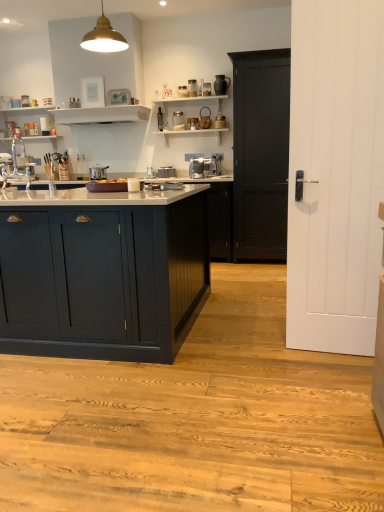
Question: Is white glossy sink at left not close to satin silver pot at center, which ranks as the 2th appliance in right-to-left order?

Choices:
 (A) yes
 (B) no

Answer: (B)

Question: Is satin silver pot at center, which appears as the first appliance when viewed from the left, surrounded by white glossy sink at left?

Choices:
 (A) no
 (B) yes

Answer: (A)

Question: Considering the relative sizes of white glossy sink at left and satin silver pot at center, which ranks as the 2th appliance in right-to-left order, in the image provided, is white glossy sink at left wider than satin silver pot at center, which ranks as the 2th appliance in right-to-left order,?

Choices:
 (A) yes
 (B) no

Answer: (B)

Question: Is white glossy sink at left oriented towards satin silver pot at center, which appears as the first appliance when viewed from the left?

Choices:
 (A) no
 (B) yes

Answer: (B)

Question: Can we say white glossy sink at left lies outside satin silver pot at center, which ranks as the 2th appliance in right-to-left order?

Choices:
 (A) no
 (B) yes

Answer: (B)

Question: Does point (122, 48) appear closer or farther from the camera than point (94, 167)?

Choices:
 (A) farther
 (B) closer

Answer: (B)

Question: Relative to satin silver pot at center, which ranks as the 2th appliance in right-to-left order, is metallic gold pendant light at upper center in front or behind?

Choices:
 (A) front
 (B) behind

Answer: (A)

Question: Considering the positions of metallic gold pendant light at upper center and satin silver pot at center, which appears as the first appliance when viewed from the left, in the image, is metallic gold pendant light at upper center bigger or smaller than satin silver pot at center, which appears as the first appliance when viewed from the left,?

Choices:
 (A) big
 (B) small

Answer: (A)

Question: Considering the positions of metallic gold pendant light at upper center and satin silver pot at center, which appears as the first appliance when viewed from the left, in the image, is metallic gold pendant light at upper center wider or thinner than satin silver pot at center, which appears as the first appliance when viewed from the left,?

Choices:
 (A) wide
 (B) thin

Answer: (B)

Question: Relative to matte dark blue cabinet at center-left, which is the second cabinetry from back to front, is white glossy sink at left in front or behind?

Choices:
 (A) behind
 (B) front

Answer: (A)

Question: From a real-world perspective, relative to matte dark blue cabinet at center-left, the 2th cabinetry positioned from the right, is white glossy sink at left vertically above or below?

Choices:
 (A) above
 (B) below

Answer: (A)

Question: From the image's perspective, is white glossy sink at left above or below matte dark blue cabinet at center-left, the 2th cabinetry positioned from the right?

Choices:
 (A) below
 (B) above

Answer: (B)

Question: Would you say white glossy sink at left is inside or outside matte dark blue cabinet at center-left, which is the second cabinetry from back to front?

Choices:
 (A) inside
 (B) outside

Answer: (B)

Question: Relative to satin silver pot at center, which ranks as the 2th appliance in right-to-left order, is white glossy shelf at upper center, which ranks as the second shelf in left-to-right order, in front or behind?

Choices:
 (A) front
 (B) behind

Answer: (A)

Question: Is white glossy shelf at upper center, arranged as the 1th shelf when viewed from the right, taller or shorter than satin silver pot at center, which ranks as the 2th appliance in right-to-left order?

Choices:
 (A) short
 (B) tall

Answer: (A)